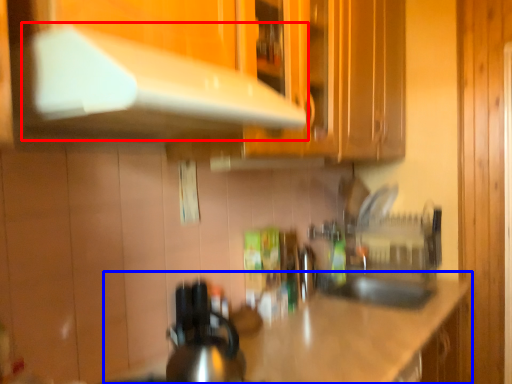
Question: Among these objects, which one is nearest to the camera, exhaust hood (highlighted by a red box) or countertop (highlighted by a blue box)?

Choices:
 (A) exhaust hood
 (B) countertop

Answer: (A)